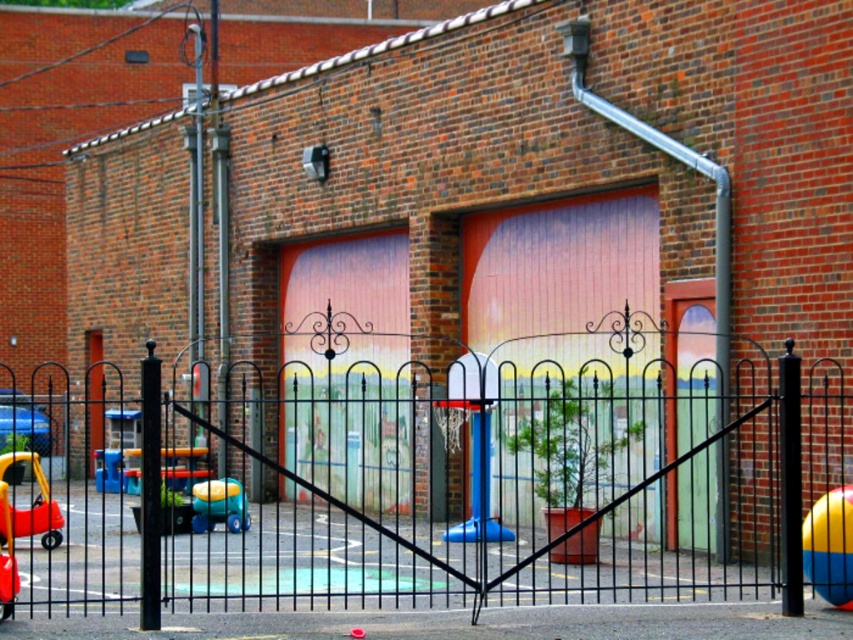
Consider the image. You are a parent trying to retrieve your child who is playing near the pink painted wood garage door at center and the matte plastic toy car at lower left. From your position outside the slightly ajar gate, which object should you move toward first to reach your child?

You should move toward the matte plastic toy car at lower left first because the pink painted wood garage door at center is to the right of it, meaning the toy car is closer to the gate entrance.

You are a parent trying to retrieve your child who is playing near the pink painted wood garage door at center and the matte plastic toy car at lower left. Which object is closer to the ground?

The matte plastic toy car at lower left is closer to the ground since the pink painted wood garage door at center is above it.

You are a parent trying to put away toys in the fenced area. You have a yellow rubber beach ball at right and a matte yellow plastic car at lower left. Which toy takes up more space and needs a larger storage container?

The matte yellow plastic car at lower left occupies more space than the yellow rubber beach ball at right, so it needs a larger storage container.